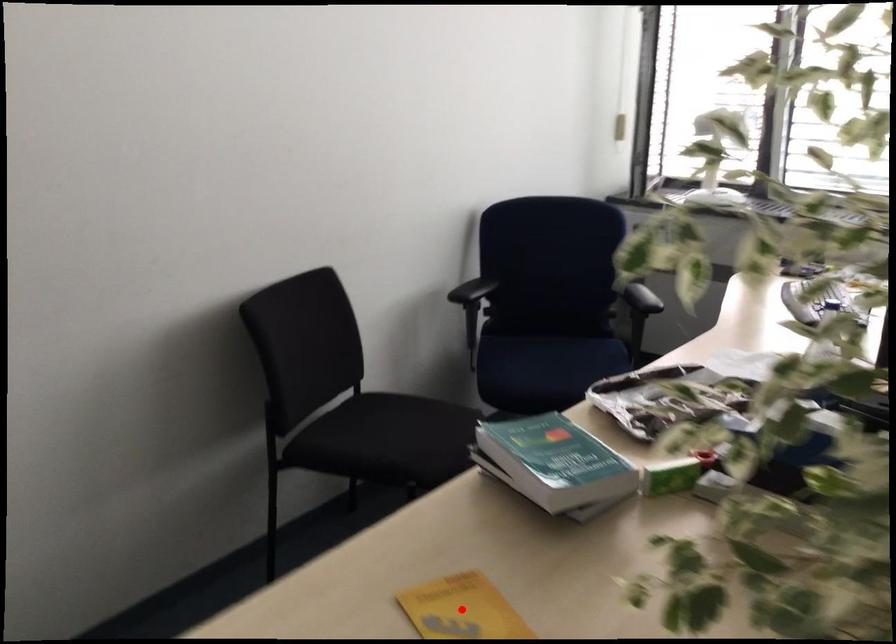
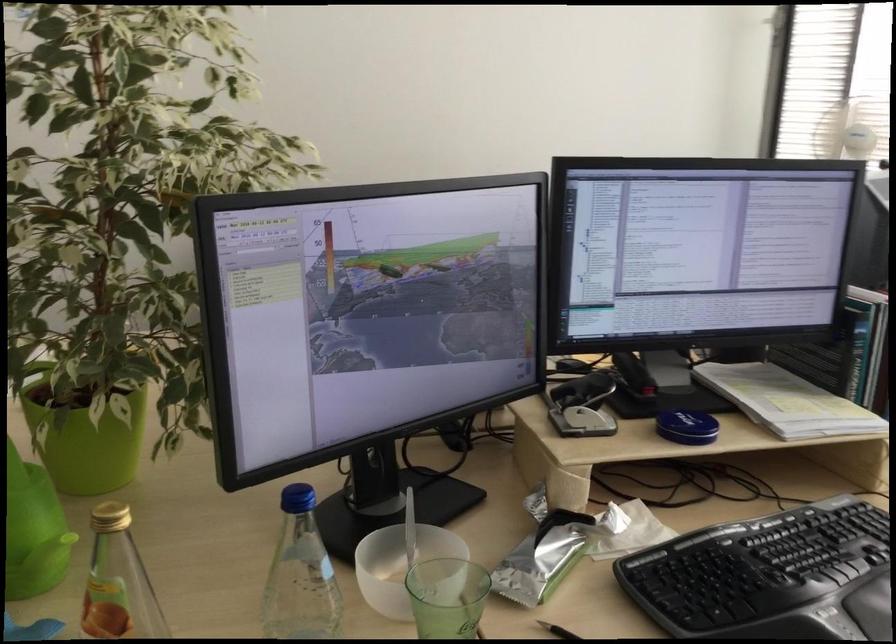
Question: I am providing you with two images of the same scene from different viewpoints. A red point is marked on the first image. Is the red point's position out of view in image 2?

Choices:
 (A) Yes
 (B) No

Answer: (A)